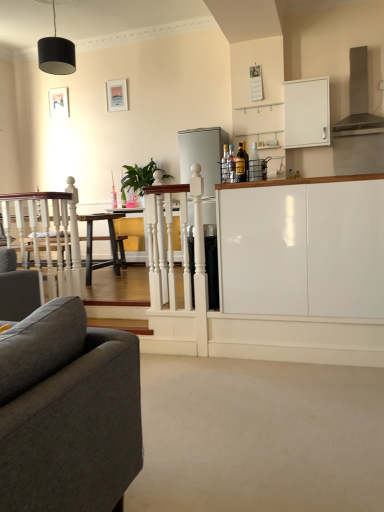
Question: Is satin silver refrigerator at center next to white glossy cabinet at upper right, which appears as the 2th cabinetry when ordered from the bottom, and touching it?

Choices:
 (A) yes
 (B) no

Answer: (B)

Question: Is satin silver refrigerator at center to the right of white glossy cabinet at upper right, which is counted as the second cabinetry, starting from the front, from the viewer's perspective?

Choices:
 (A) yes
 (B) no

Answer: (B)

Question: Is satin silver refrigerator at center bigger than white glossy cabinet at upper right, which appears as the 2th cabinetry when ordered from the bottom?

Choices:
 (A) no
 (B) yes

Answer: (B)

Question: Considering the relative positions of satin silver refrigerator at center and white glossy cabinet at upper right, which appears as the 2th cabinetry when ordered from the bottom, in the image provided, is satin silver refrigerator at center in front of white glossy cabinet at upper right, which appears as the 2th cabinetry when ordered from the bottom,?

Choices:
 (A) yes
 (B) no

Answer: (B)

Question: Is satin silver refrigerator at center surrounding white glossy cabinet at upper right, the 1th cabinetry when ordered from top to bottom?

Choices:
 (A) yes
 (B) no

Answer: (B)

Question: In the image, is black matte lampshade at upper center on the left side or the right side of white glossy cabinet at center, marked as the 1th cabinetry in a bottom-to-top arrangement?

Choices:
 (A) right
 (B) left

Answer: (B)

Question: Is black matte lampshade at upper center spatially inside white glossy cabinet at center, which appears as the second cabinetry when viewed from the top, or outside of it?

Choices:
 (A) inside
 (B) outside

Answer: (B)

Question: In the image, is black matte lampshade at upper center positioned in front of or behind white glossy cabinet at center, placed as the first cabinetry when sorted from front to back?

Choices:
 (A) behind
 (B) front

Answer: (A)

Question: From the image's perspective, is black matte lampshade at upper center positioned above or below white glossy cabinet at center, marked as the 1th cabinetry in a bottom-to-top arrangement?

Choices:
 (A) above
 (B) below

Answer: (A)

Question: Is white wooden railing at center wider or thinner than black matte lampshade at upper center?

Choices:
 (A) wide
 (B) thin

Answer: (B)

Question: From a real-world perspective, is white wooden railing at center positioned above or below black matte lampshade at upper center?

Choices:
 (A) above
 (B) below

Answer: (B)

Question: Is point (188, 289) positioned closer to the camera than point (69, 42)?

Choices:
 (A) farther
 (B) closer

Answer: (B)

Question: Would you say white wooden railing at center is to the left or to the right of black matte lampshade at upper center in the picture?

Choices:
 (A) right
 (B) left

Answer: (A)

Question: From the image's perspective, is matte white picture frame at upper center, the first picture frame when ordered from front to back, positioned above or below matte gray exhaust hood at upper right?

Choices:
 (A) below
 (B) above

Answer: (B)

Question: Based on their positions, is matte white picture frame at upper center, the 1th picture frame when ordered from right to left, located to the left or right of matte gray exhaust hood at upper right?

Choices:
 (A) right
 (B) left

Answer: (B)